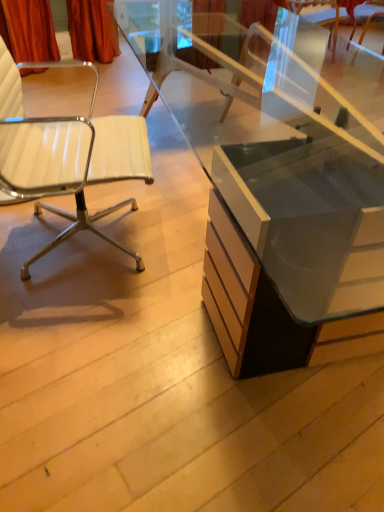
You are a GUI agent. You are given a task and a screenshot of the screen. Output one action in this format:
    pyautogui.click(x=<x>, y=<y>)
    Task: Click on the vacant space underneath white leather chair at left, which ranks as the second chair in top-to-bottom order (from a real-world perspective)
    
    Given the screenshot: What is the action you would take?
    pyautogui.click(x=67, y=241)